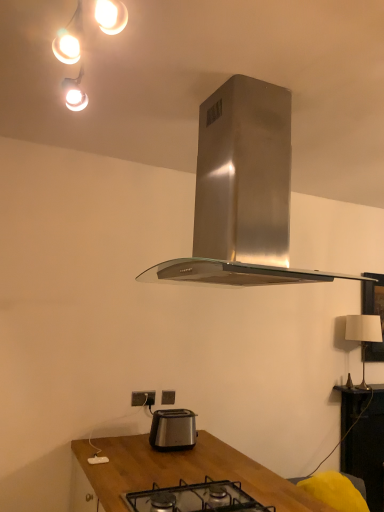
Question: Does wooden table at lower right have a lesser width compared to black glass gas stove at center?

Choices:
 (A) yes
 (B) no

Answer: (A)

Question: Does wooden table at lower right appear on the left side of black glass gas stove at center?

Choices:
 (A) yes
 (B) no

Answer: (B)

Question: Can you confirm if wooden table at lower right is wider than black glass gas stove at center?

Choices:
 (A) yes
 (B) no

Answer: (B)

Question: Considering the relative sizes of wooden table at lower right and black glass gas stove at center in the image provided, is wooden table at lower right smaller than black glass gas stove at center?

Choices:
 (A) no
 (B) yes

Answer: (A)

Question: Is the surface of wooden table at lower right in direct contact with black glass gas stove at center?

Choices:
 (A) yes
 (B) no

Answer: (B)

Question: From a real-world perspective, is wooden table at lower right over black glass gas stove at center?

Choices:
 (A) no
 (B) yes

Answer: (A)

Question: Does satin silver power plugs and sockets at lower center, marked as the 1th power plugs and sockets in a right-to-left arrangement, lie in front of black glass gas stove at center?

Choices:
 (A) no
 (B) yes

Answer: (A)

Question: Is satin silver power plugs and sockets at lower center, which appears as the first power plugs and sockets when viewed from the back, touching black glass gas stove at center?

Choices:
 (A) no
 (B) yes

Answer: (A)

Question: Is black glass gas stove at center inside satin silver power plugs and sockets at lower center, positioned as the second power plugs and sockets in left-to-right order?

Choices:
 (A) no
 (B) yes

Answer: (A)

Question: Is satin silver power plugs and sockets at lower center, which appears as the first power plugs and sockets when viewed from the back, aimed at black glass gas stove at center?

Choices:
 (A) yes
 (B) no

Answer: (A)

Question: From a real-world perspective, is satin silver power plugs and sockets at lower center, marked as the 1th power plugs and sockets in a right-to-left arrangement, physically below black glass gas stove at center?

Choices:
 (A) yes
 (B) no

Answer: (B)

Question: Is satin silver power plugs and sockets at lower center, the second power plugs and sockets positioned from the front, further to the viewer compared to black glass gas stove at center?

Choices:
 (A) no
 (B) yes

Answer: (B)

Question: From a real-world perspective, is stainless steel range hood at center under white plastic power plugs and sockets at lower center, the first power plugs and sockets from the front?

Choices:
 (A) yes
 (B) no

Answer: (B)